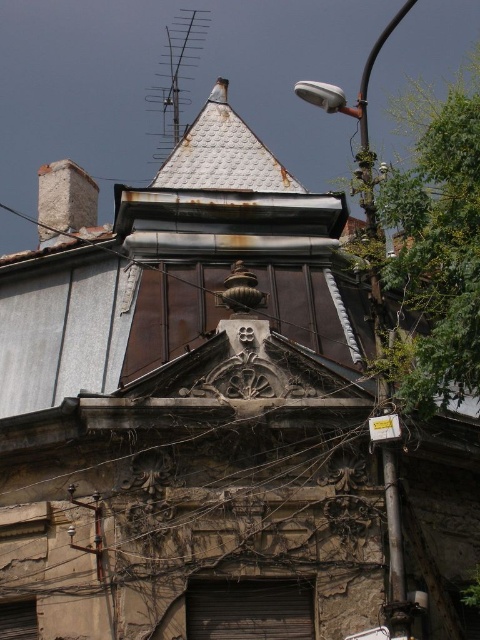
Does point (436, 268) lie behind point (345, 109)?

No.

Who is positioned more to the left, green leafy tree at upper right or metallic streetlight at upper right?

Positioned to the left is metallic streetlight at upper right.

Image resolution: width=480 pixels, height=640 pixels. What do you see at coordinates (439, 244) in the screenshot?
I see `green leafy tree at upper right` at bounding box center [439, 244].

At what (x,y) coordinates should I click in order to perform the action: click on green leafy tree at upper right. Please return your answer as a coordinate pair (x, y). Looking at the image, I should click on (439, 244).

Who is taller, green leafy tree at upper right or rusty brick chimney at upper left?

With more height is green leafy tree at upper right.

Identify the location of green leafy tree at upper right. (439, 244).

Identify the location of green leafy tree at upper right. (439, 244).

Measure the distance from rusty metal roof at upper center to rusty metal antenna at upper center.

rusty metal roof at upper center is 13.17 meters from rusty metal antenna at upper center.

Does rusty metal roof at upper center have a greater height compared to rusty metal antenna at upper center?

Correct, rusty metal roof at upper center is much taller as rusty metal antenna at upper center.

In order to click on rusty metal roof at upper center in this screenshot , I will do `click(223, 154)`.